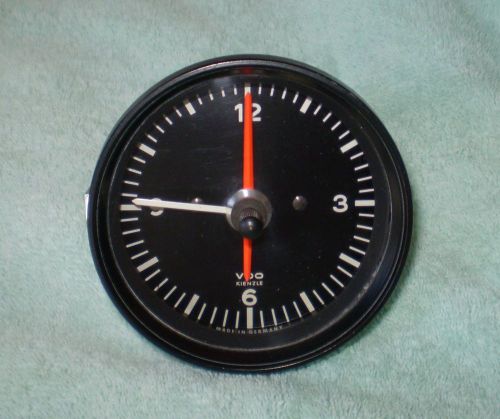
The image size is (500, 419). What are the coordinates of `clock` in the screenshot? It's located at click(x=312, y=157).